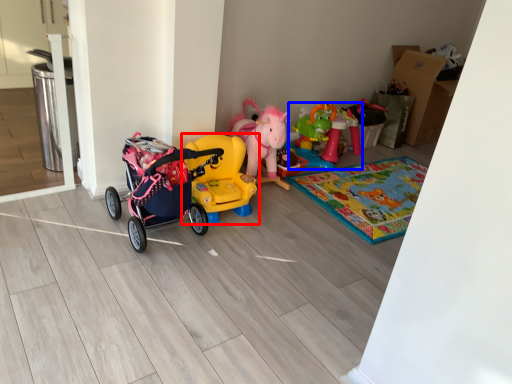
Question: Which object is closer to the camera taking this photo, toy (highlighted by a red box) or toy (highlighted by a blue box)?

Choices:
 (A) toy
 (B) toy

Answer: (A)